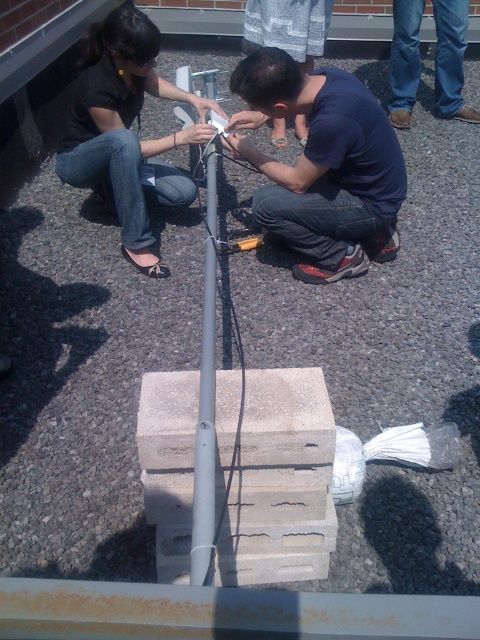
You are a safety inspector checking the distance between the dark blue shirt at center and the matte black shirt at upper left. According to safety regulations, workers must be at least 24 inches apart. Is this setup compliant?

The dark blue shirt at center and the matte black shirt at upper left are 21.51 inches apart from each other, which is less than the required 24 inches. This setup does not comply with safety regulations.

Please look at the scene where two people are working on a vertical metallic pole secured by concrete blocks on a gravel surface. The person on the left wears a dark shirt and holds a white object, while the person on the right wears a navy shirt. There is a point at coordinates (321, 163). Which object or person is this point located on?

The point at coordinates (321, 163) is located on the dark blue shirt at center.